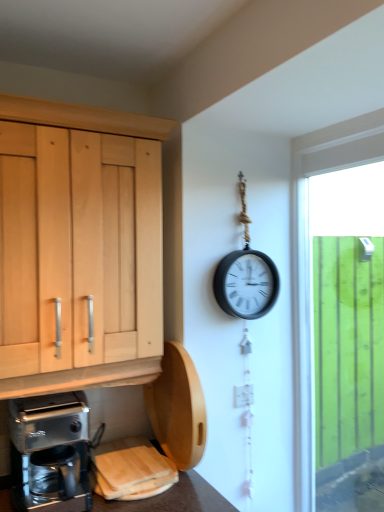
Question: From a real-world perspective, is white glossy electric outlet at center-right positioned above or below green wooden fence at right?

Choices:
 (A) below
 (B) above

Answer: (A)

Question: From the image's perspective, is white glossy electric outlet at center-right above or below green wooden fence at right?

Choices:
 (A) above
 (B) below

Answer: (B)

Question: Which is nearer to the green wooden fence at right?

Choices:
 (A) metallic silver coffee maker at lower left
 (B) white glossy electric outlet at center-right

Answer: (B)

Question: Which of these objects is positioned farthest from the white glossy electric outlet at center-right?

Choices:
 (A) metallic silver coffee maker at lower left
 (B) green wooden fence at right

Answer: (B)